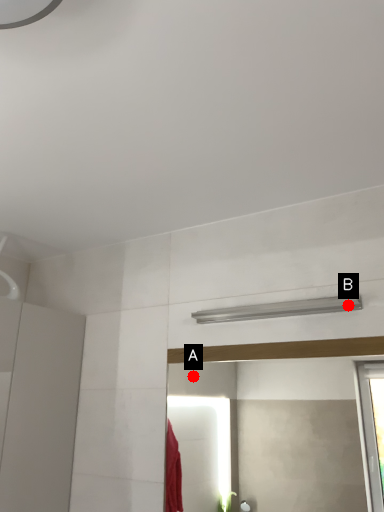
Question: Two points are circled on the image, labeled by A and B beside each circle. Which of the following is the farthest from the observer?

Choices:
 (A) A is further
 (B) B is further

Answer: (A)